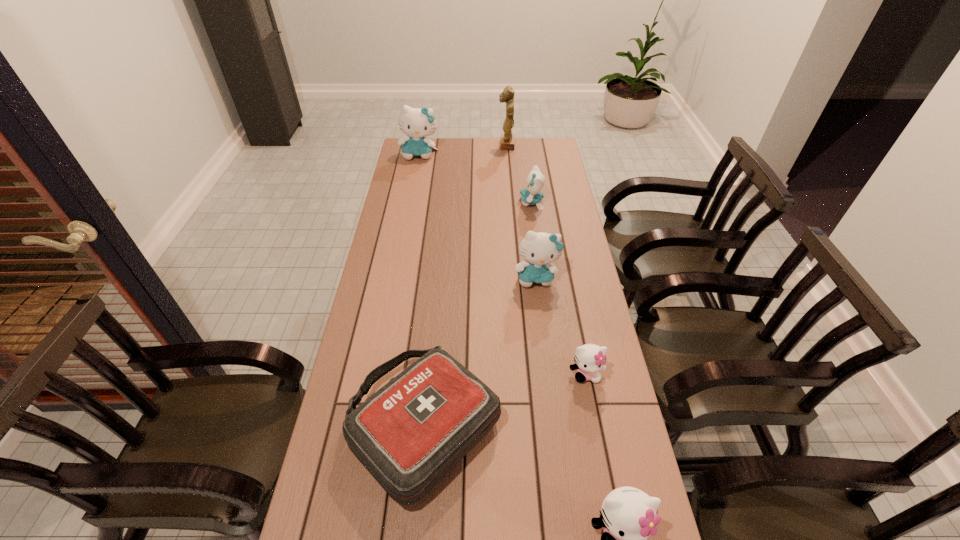
Locate an element on the screen. The height and width of the screenshot is (540, 960). free spot between the second farthest blue kitten and the tallest kitten is located at coordinates (475, 179).

You are a GUI agent. You are given a task and a screenshot of the screen. Output one action in this format:
    pyautogui.click(x=<x>, y=<y>)
    Task: Click on the free space that is in between the third farthest object and the biggest blue kitten
    The width and height of the screenshot is (960, 540).
    Given the screenshot: What is the action you would take?
    pyautogui.click(x=475, y=179)

Where is `vacant region between the farthest blue kitten and the figurine`? vacant region between the farthest blue kitten and the figurine is located at coordinates (463, 150).

The height and width of the screenshot is (540, 960). What are the coordinates of `vacant area that lies between the tallest object and the red first-aid kit` in the screenshot? It's located at (466, 285).

The width and height of the screenshot is (960, 540). I want to click on vacant area that lies between the leftmost blue kitten and the second smallest blue kitten, so click(x=478, y=216).

Identify the location of object that is the sixth closest to the tallest object. This screenshot has width=960, height=540. (629, 516).

Point out which object is positioned as the sixth nearest to the fourth farthest object. Please provide its 2D coordinates. Your answer should be formatted as a tuple, i.e. [(x, y)], where the tuple contains the x and y coordinates of a point satisfying the conditions above.

[(507, 139)]

I want to click on kitten object that ranks as the second closest to the farther white kitten, so click(629, 516).

Locate an element on the screen. the fourth closest kitten to the figurine is located at coordinates (590, 358).

Locate which blue kitten ranks third in proximity to the red first-aid kit. Please provide its 2D coordinates. Your answer should be formatted as a tuple, i.e. [(x, y)], where the tuple contains the x and y coordinates of a point satisfying the conditions above.

[(417, 123)]